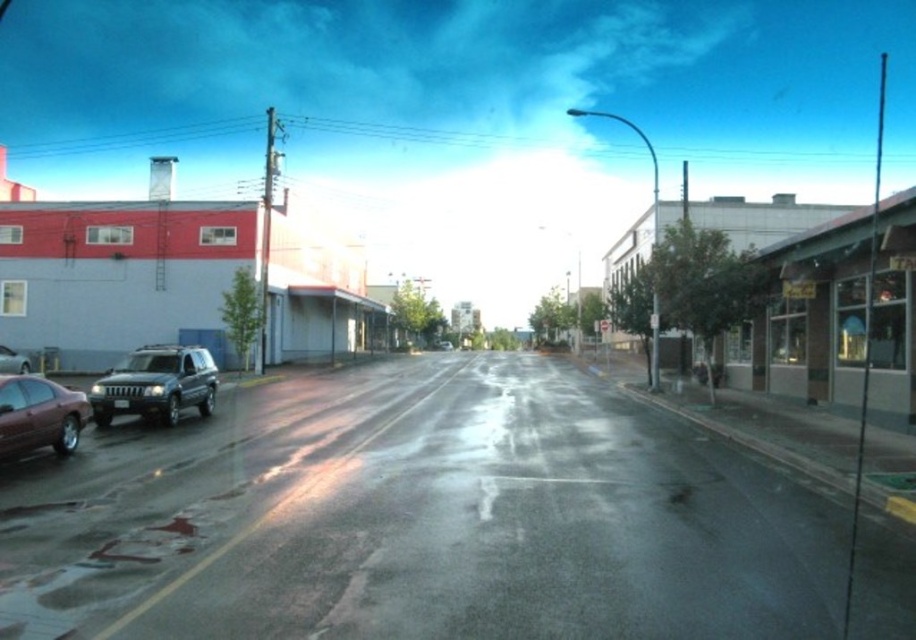
Question: Is metallic gray suv at left positioned in front of shiny maroon sedan at lower left?

Choices:
 (A) yes
 (B) no

Answer: (B)

Question: Which object is closer to the camera taking this photo?

Choices:
 (A) shiny silver sedan at left
 (B) metallic gray suv at left

Answer: (B)

Question: Which is farther from the shiny silver sedan at left?

Choices:
 (A) metallic gray suv at left
 (B) shiny maroon sedan at lower left

Answer: (B)

Question: Does shiny maroon sedan at lower left lie in front of shiny silver sedan at left?

Choices:
 (A) yes
 (B) no

Answer: (A)

Question: Does metallic gray suv at left have a smaller size compared to shiny maroon sedan at lower left?

Choices:
 (A) no
 (B) yes

Answer: (A)

Question: Considering the real-world distances, which object is closest to the shiny silver sedan at left?

Choices:
 (A) shiny maroon sedan at lower left
 (B) metallic gray suv at left

Answer: (B)